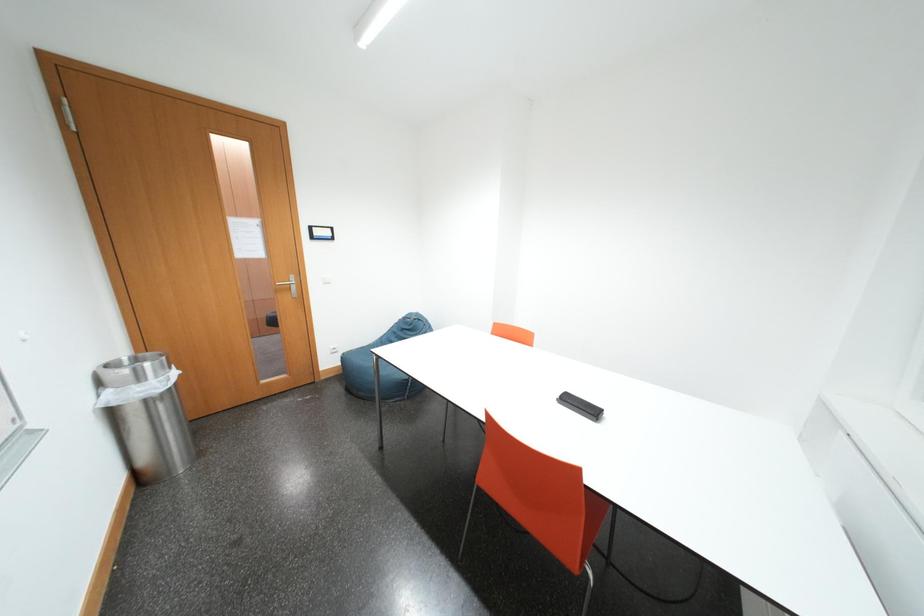
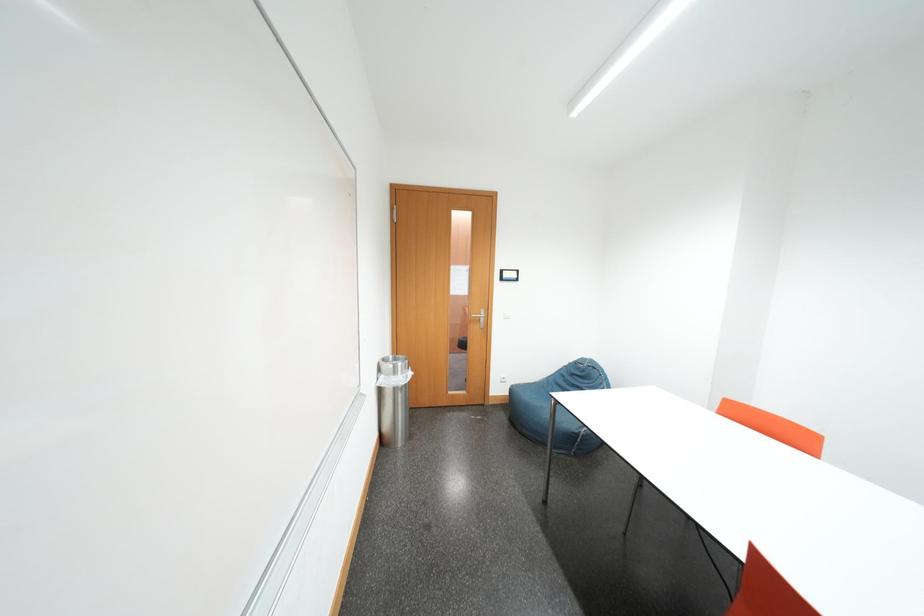
Question: How did the camera likely rotate?

Choices:
 (A) Left
 (B) Right
 (C) Up
 (D) Down

Answer: (A)